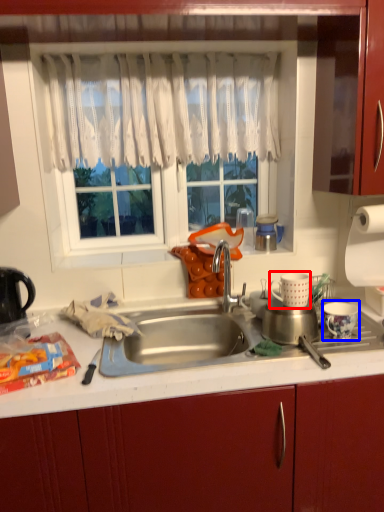
Question: Among these objects, which one is farthest to the camera, appliance (highlighted by a red box) or appliance (highlighted by a blue box)?

Choices:
 (A) appliance
 (B) appliance

Answer: (A)